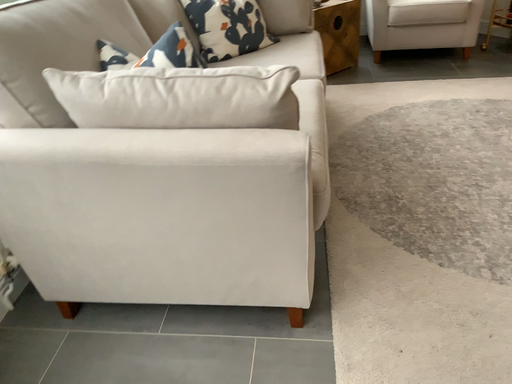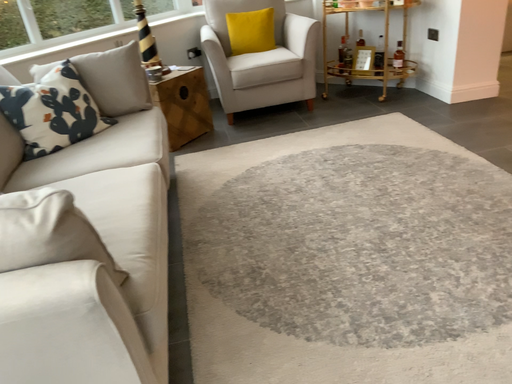
Question: How did the camera likely rotate when shooting the video?

Choices:
 (A) rotated downward
 (B) rotated upward

Answer: (B)